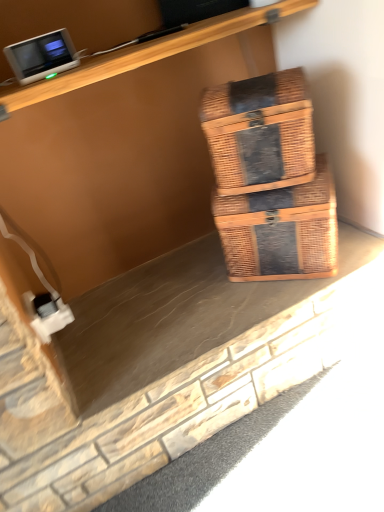
Find the location of a particular element. vacant area on top of woven brown box at center, arranged as the 2th box when ordered from the bottom (from a real-world perspective) is located at coordinates (256, 80).